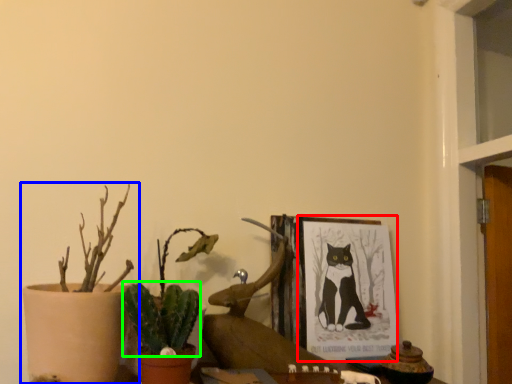
Question: Based on their relative distances, which object is farther from picture frame (highlighted by a red box)? Choose from houseplant (highlighted by a blue box) and plant (highlighted by a green box).

Choices:
 (A) houseplant
 (B) plant

Answer: (A)